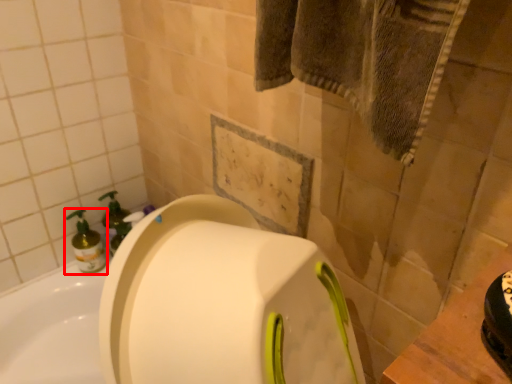
Question: From the image, what is the correct spatial relationship of cleaning product (annotated by the red box) in relation to soap dispenser?

Choices:
 (A) left
 (B) right

Answer: (A)